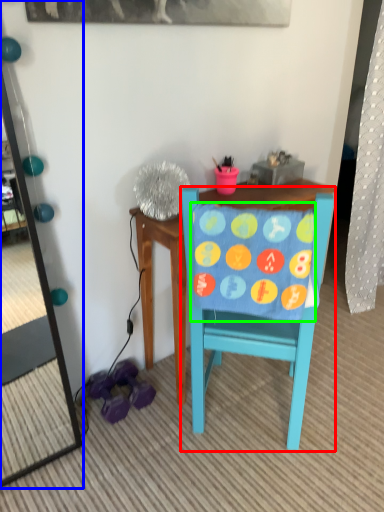
Question: Which is nearer to the chair (highlighted by a red box)? mirror (highlighted by a blue box) or blanket (highlighted by a green box).

Choices:
 (A) mirror
 (B) blanket

Answer: (B)